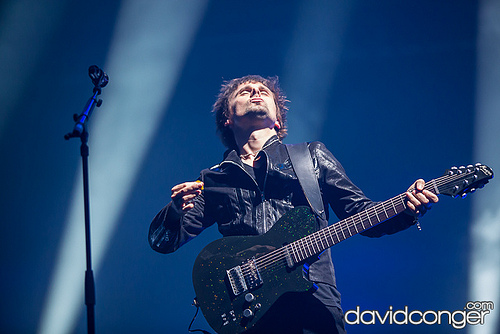
You are a GUI agent. You are given a task and a screenshot of the screen. Output one action in this format:
    pyautogui.click(x=<x>, y=<y>)
    Task: Click on the wall
    
    Given the screenshot: What is the action you would take?
    (344, 80)